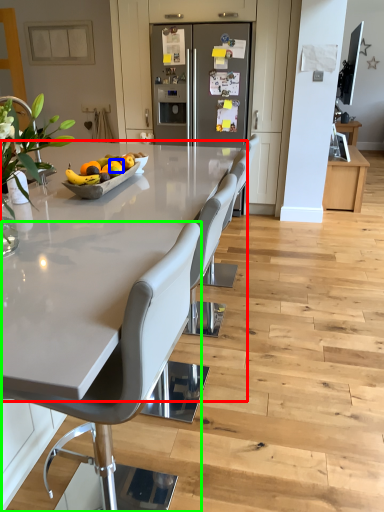
Question: Estimate the real-world distances between objects in this image. Which object is closer to countertop (highlighted by a red box), orange (highlighted by a blue box) or chair (highlighted by a green box)?

Choices:
 (A) orange
 (B) chair

Answer: (B)